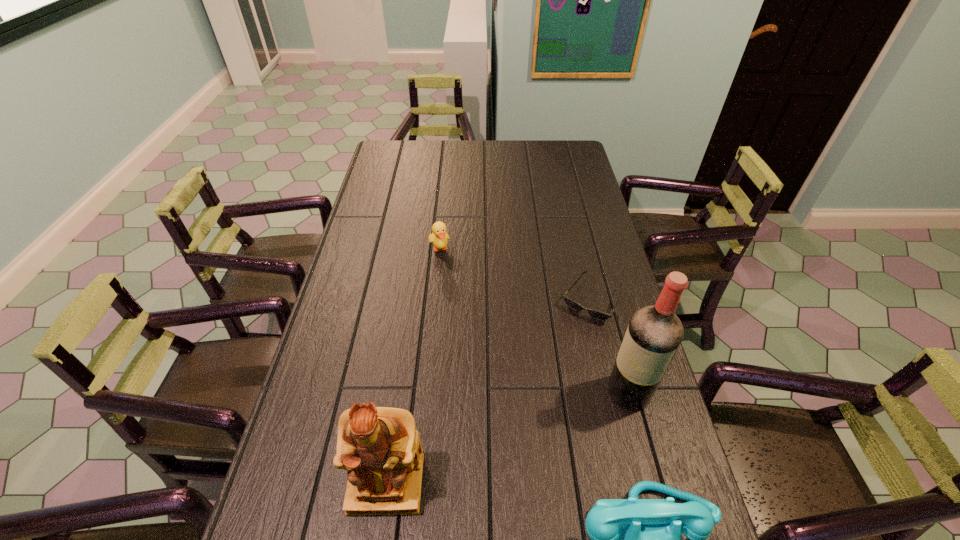
Locate an element on the screen. the second tallest object is located at coordinates (380, 447).

Image resolution: width=960 pixels, height=540 pixels. Find the location of `the tallest object`. the tallest object is located at coordinates (654, 333).

This screenshot has height=540, width=960. In order to click on the third farthest object in this screenshot , I will do `click(654, 333)`.

Identify the location of sunglasses. The width and height of the screenshot is (960, 540). (596, 314).

You are a GUI agent. You are given a task and a screenshot of the screen. Output one action in this format:
    pyautogui.click(x=<x>, y=<y>)
    Task: Click on the shortest object
    Image resolution: width=960 pixels, height=540 pixels.
    Given the screenshot: What is the action you would take?
    [596, 314]

Find the location of `the farthest object`. the farthest object is located at coordinates [x=439, y=237].

Where is `duckling`? duckling is located at coordinates (439, 237).

Where is `vacant space located on the front-facing side of the liquor`? This screenshot has width=960, height=540. vacant space located on the front-facing side of the liquor is located at coordinates (535, 531).

Where is `free region located 0.190m on the front-facing side of the liquor`? The width and height of the screenshot is (960, 540). free region located 0.190m on the front-facing side of the liquor is located at coordinates (580, 464).

The image size is (960, 540). I want to click on vacant space located on the front-facing side of the liquor, so click(538, 527).